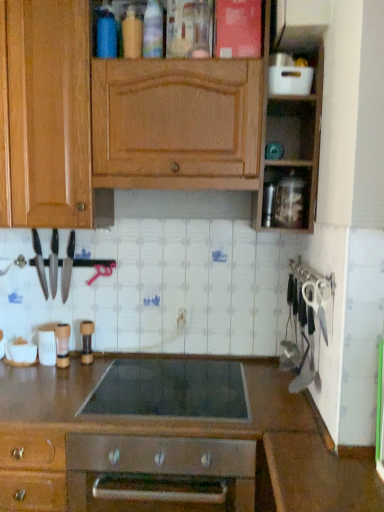
Question: In terms of size, does polished stainless steel knives at left, the first kitchen appliance viewed from the right, appear bigger or smaller than brown matte pepper grinder at center, placed as the third appliance when sorted from top to bottom?

Choices:
 (A) big
 (B) small

Answer: (A)

Question: Relative to brown matte pepper grinder at center, placed as the third appliance when sorted from top to bottom, is polished stainless steel knives at left, the 3th kitchen appliance positioned from the left, in front or behind?

Choices:
 (A) behind
 (B) front

Answer: (A)

Question: Which is farther from the black metal knife at left, positioned as the 3th kitchen appliance in right-to-left order?

Choices:
 (A) wooden cabinet at upper center
 (B) black glass cooktop at center
 (C) transparent plastic container at upper right, the second appliance viewed from the right
 (D) brown matte pepper grinder at center, placed as the third appliance when sorted from top to bottom
 (E) white plastic container at upper right, marked as the first appliance in a top-to-bottom arrangement

Answer: (E)

Question: Which is nearer to the black metal knife at left, which ranks as the first kitchen appliance in left-to-right order?

Choices:
 (A) white plastic container at upper right, which is counted as the 6th appliance, starting from the left
 (B) polished stainless steel knives at left, the first kitchen appliance viewed from the right
 (C) white plastic container at lower left, which is counted as the second appliance, starting from the bottom
 (D) black plastic knife at left, arranged as the second kitchen appliance when viewed from the left
 (E) black glass cooktop at center

Answer: (D)